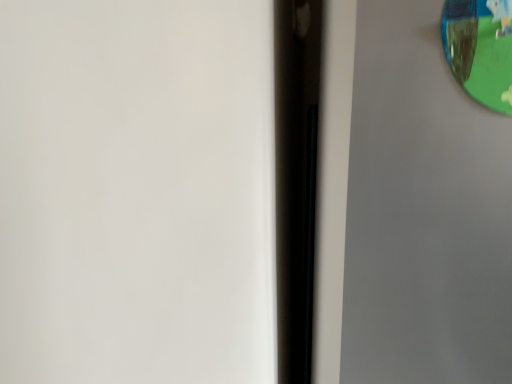
Question: Can you confirm if green plastic view mirror at upper right is positioned to the left of transparent plastic screen door at upper right?

Choices:
 (A) yes
 (B) no

Answer: (A)

Question: Is transparent plastic screen door at upper right inside green plastic view mirror at upper right?

Choices:
 (A) yes
 (B) no

Answer: (B)

Question: From a real-world perspective, is green plastic view mirror at upper right on top of transparent plastic screen door at upper right?

Choices:
 (A) yes
 (B) no

Answer: (A)

Question: From the image's perspective, is green plastic view mirror at upper right beneath transparent plastic screen door at upper right?

Choices:
 (A) no
 (B) yes

Answer: (A)

Question: From the image's perspective, is green plastic view mirror at upper right above transparent plastic screen door at upper right?

Choices:
 (A) no
 (B) yes

Answer: (B)

Question: Can you confirm if green plastic view mirror at upper right is wider than transparent plastic screen door at upper right?

Choices:
 (A) no
 (B) yes

Answer: (A)

Question: Are transparent plastic screen door at upper right and green plastic view mirror at upper right far apart?

Choices:
 (A) yes
 (B) no

Answer: (B)

Question: From a real-world perspective, is transparent plastic screen door at upper right positioned over green plastic view mirror at upper right based on gravity?

Choices:
 (A) no
 (B) yes

Answer: (A)

Question: Is transparent plastic screen door at upper right taller than green plastic view mirror at upper right?

Choices:
 (A) yes
 (B) no

Answer: (A)

Question: Can you confirm if transparent plastic screen door at upper right is smaller than green plastic view mirror at upper right?

Choices:
 (A) no
 (B) yes

Answer: (A)

Question: Does transparent plastic screen door at upper right have a lesser height compared to green plastic view mirror at upper right?

Choices:
 (A) yes
 (B) no

Answer: (B)

Question: Can you confirm if transparent plastic screen door at upper right is thinner than green plastic view mirror at upper right?

Choices:
 (A) no
 (B) yes

Answer: (A)

Question: Is green plastic view mirror at upper right to the left or to the right of transparent plastic screen door at upper right in the image?

Choices:
 (A) left
 (B) right

Answer: (A)